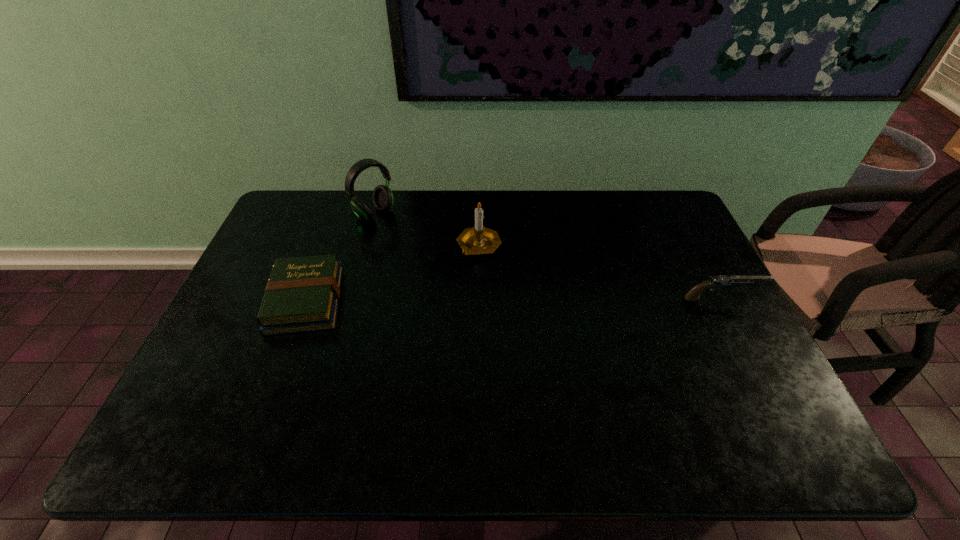
Find the location of `empty space that is in between the third shortest object and the shortest object`. empty space that is in between the third shortest object and the shortest object is located at coordinates (392, 273).

You are a GUI agent. You are given a task and a screenshot of the screen. Output one action in this format:
    pyautogui.click(x=<x>, y=<y>)
    Task: Click on the vacant space in between the tallest object and the shortest object
    The image size is (960, 540).
    Given the screenshot: What is the action you would take?
    pyautogui.click(x=340, y=257)

I want to click on free area in between the book and the second farthest object, so click(392, 273).

The image size is (960, 540). Identify the location of vacant space in between the second object from right to left and the farthest object. (426, 230).

This screenshot has height=540, width=960. I want to click on object that ranks as the third closest to the book, so click(x=717, y=281).

The image size is (960, 540). I want to click on object that is the nearest to the candle holder, so click(383, 199).

This screenshot has height=540, width=960. I want to click on vacant position in the image that satisfies the following two spatial constraints: 1. on the front side of the gun; 2. aiming along the barrel of the third nearest object, so click(478, 299).

Image resolution: width=960 pixels, height=540 pixels. Find the location of `vacant space that satisfies the following two spatial constraints: 1. on the front side of the third tallest object; 2. aiming along the barrel of the candle holder`. vacant space that satisfies the following two spatial constraints: 1. on the front side of the third tallest object; 2. aiming along the barrel of the candle holder is located at coordinates (478, 299).

Identify the location of free location that satisfies the following two spatial constraints: 1. on the front side of the gun; 2. aiming along the barrel of the tallest object. (351, 299).